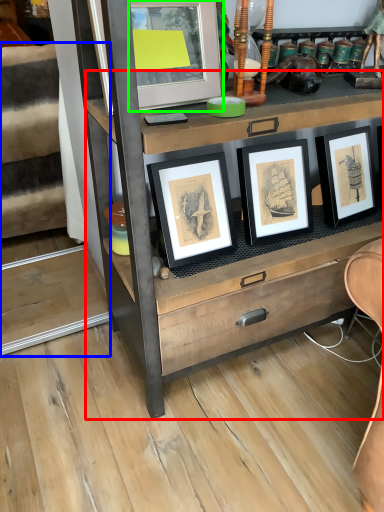
Question: Which object is positioned closest to chest of drawers (highlighted by a red box)? Select from stairwell (highlighted by a blue box) and picture frame (highlighted by a green box).

Choices:
 (A) stairwell
 (B) picture frame

Answer: (B)